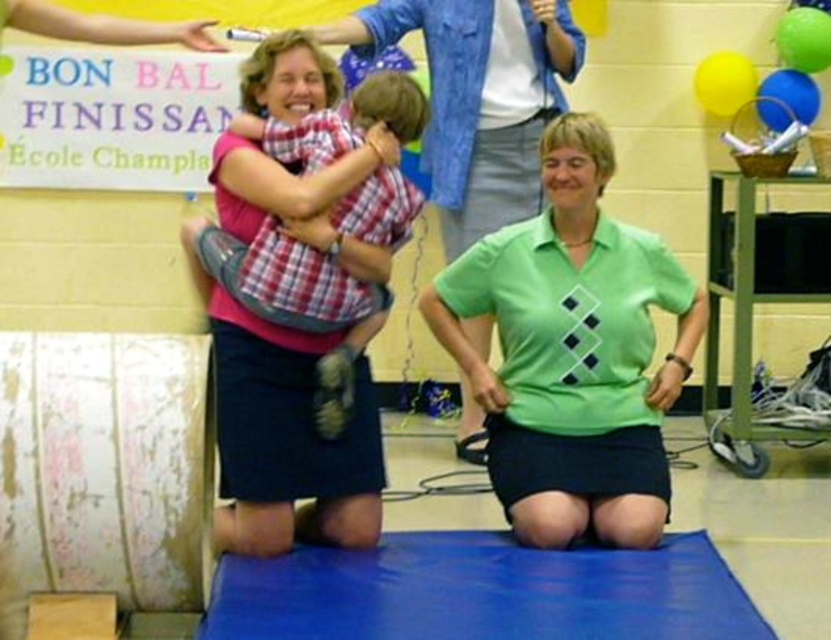
Question: Which object is positioned closest to the green argyle polo shirt at center?

Choices:
 (A) green argyle sweater at center
 (B) plaid fabric shirt at upper left

Answer: (B)

Question: Can you confirm if green argyle polo shirt at center is wider than plaid fabric shirt at upper left?

Choices:
 (A) no
 (B) yes

Answer: (B)

Question: Which of these objects is positioned closest to the blue fabric yoga mat at center?

Choices:
 (A) green argyle sweater at center
 (B) green argyle polo shirt at center
 (C) plaid fabric shirt at upper left

Answer: (B)

Question: Can you confirm if green argyle polo shirt at center is positioned below plaid fabric shirt at upper left?

Choices:
 (A) no
 (B) yes

Answer: (B)

Question: Does blue fabric yoga mat at center appear over green argyle sweater at center?

Choices:
 (A) yes
 (B) no

Answer: (B)

Question: Which point appears closest to the camera in this image?

Choices:
 (A) (434, 547)
 (B) (502, 237)

Answer: (A)